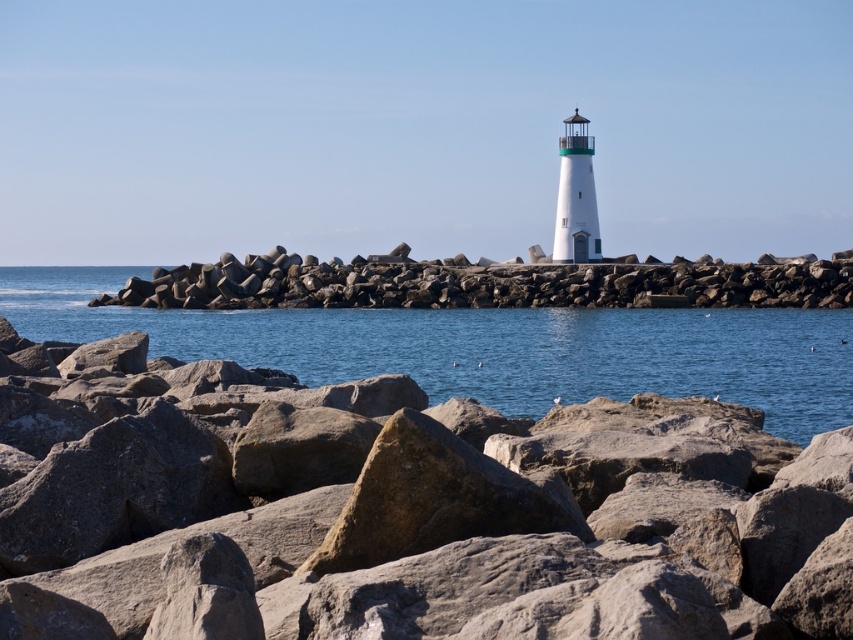
You are standing on the breakwater and see the gray rock at center and the rockyroughrocks at center. Which one is closer to you?

The gray rock at center is closer to the viewer than the rockyroughrocks at center.

You are standing on the rocky breakwater and want to reach the blue water at center. Which direction should you move relative to the gray rock at center?

Since the gray rock at center is located below the blue water at center, you should move downward towards the gray rock at center to reach the blue water at center.